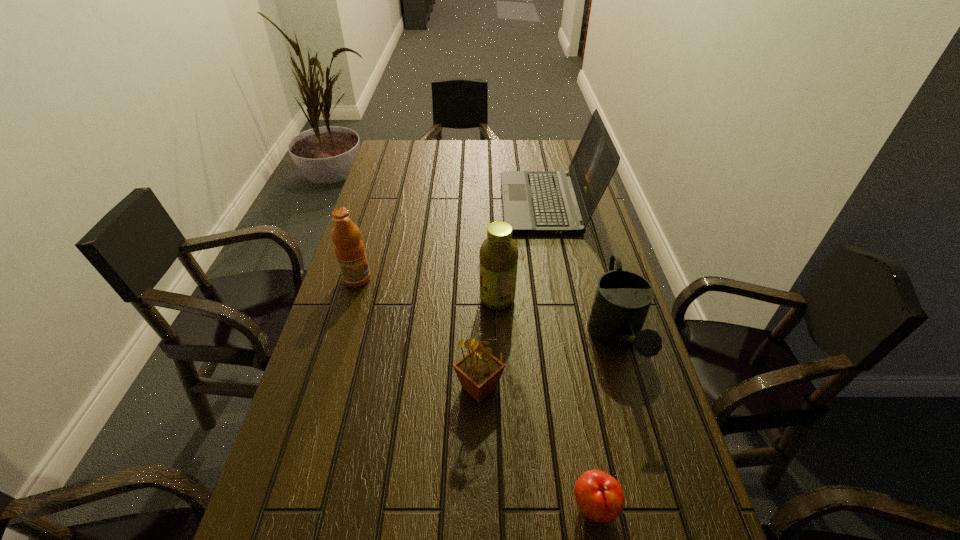
You are a GUI agent. You are given a task and a screenshot of the screen. Output one action in this format:
    pyautogui.click(x=<x>, y=<y>)
    Task: Click on the blank space located 0.100m on the front label of the right fruit juice
    The width and height of the screenshot is (960, 540).
    Given the screenshot: What is the action you would take?
    pyautogui.click(x=444, y=299)

The image size is (960, 540). I want to click on free location located 0.190m on the front label of the right fruit juice, so click(x=411, y=299).

In order to click on vacant region located 0.240m on the front label of the right fruit juice in this screenshot , I will do `click(393, 299)`.

Identify the location of vacant space located 0.380m on the label side of the leftmost object. (501, 279).

The height and width of the screenshot is (540, 960). Identify the location of free spot located 0.170m at the front of the sunflower with flowers visible. (479, 489).

This screenshot has width=960, height=540. In order to click on vacant space located with the spout on the watering can in this screenshot , I will do `click(642, 429)`.

You are a GUI agent. You are given a task and a screenshot of the screen. Output one action in this format:
    pyautogui.click(x=<x>, y=<y>)
    Task: Click on the free space located 0.140m on the left of the nearest object
    
    Given the screenshot: What is the action you would take?
    pyautogui.click(x=497, y=506)

Where is `object that is at the left edge`? This screenshot has width=960, height=540. object that is at the left edge is located at coordinates (349, 249).

Identify the location of laptop_computer positioned at the right edge. The width and height of the screenshot is (960, 540). (547, 202).

The image size is (960, 540). I want to click on watering can positioned at the right edge, so click(622, 299).